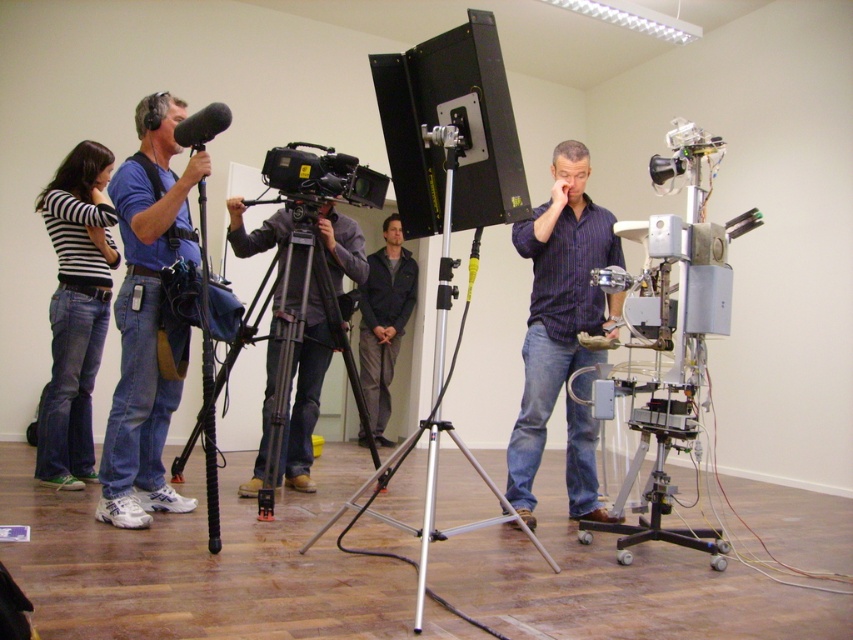
You are an assistant who needs to locate the striped cotton shirt at left in the image. What are its coordinates?

The striped cotton shirt at left is located at coordinates point (74, 310).

You are a technician in a studio setting. You need to place a new equipment case on the floor near the point marked at coordinates (146, 317). However, the area around this point is occupied by blue jeans at left. Can you place the equipment case there?

The point at coordinates (146, 317) is on blue jeans at left, so the area is occupied by blue jeans at left. Therefore, you cannot place the equipment case there.

You are an actor in a studio and you see the blue jeans at left and the dark blue jacket at center. Which clothing item is positioned more to the left side of the studio?

The blue jeans at left are positioned more to the left side of the studio than the dark blue jacket at center.